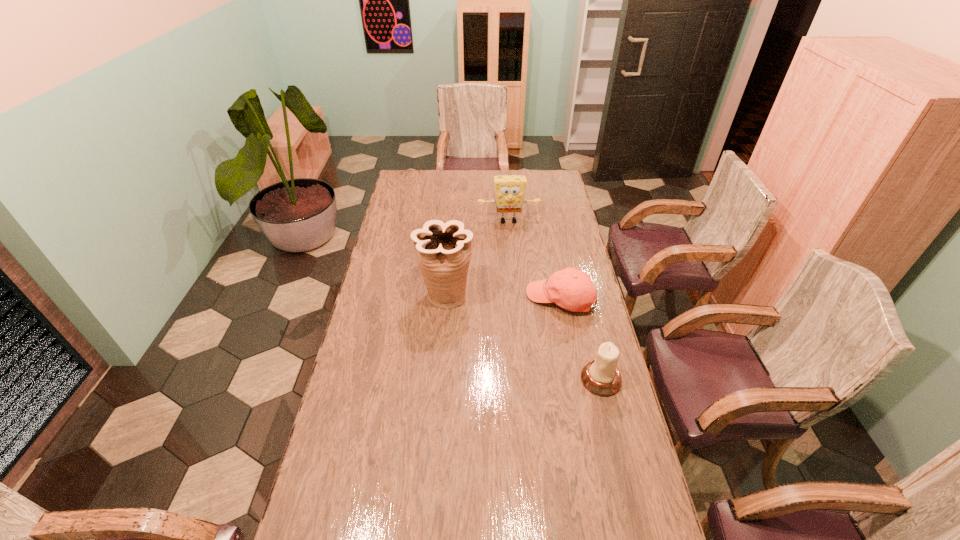
Locate an element on the screen. The height and width of the screenshot is (540, 960). vacant space in between the shortest object and the candle holder is located at coordinates (581, 339).

Image resolution: width=960 pixels, height=540 pixels. In order to click on vacant region between the candle holder and the baseball cap in this screenshot , I will do `click(581, 339)`.

At what (x,y) coordinates should I click in order to perform the action: click on object that can be found as the closest to the candle holder. Please return your answer as a coordinate pair (x, y). The image size is (960, 540). Looking at the image, I should click on (572, 289).

This screenshot has height=540, width=960. What are the coordinates of `object identified as the closest to the shortest object` in the screenshot? It's located at (443, 250).

This screenshot has height=540, width=960. What are the coordinates of `free spot that satisfies the following two spatial constraints: 1. on the front side of the second shortest object; 2. on the left side of the shortest object` in the screenshot? It's located at (575, 380).

Where is `vacant space that satisfies the following two spatial constraints: 1. on the back side of the sponge; 2. on the left side of the urn`? vacant space that satisfies the following two spatial constraints: 1. on the back side of the sponge; 2. on the left side of the urn is located at coordinates (452, 221).

Identify the location of free space that satisfies the following two spatial constraints: 1. on the back side of the farthest object; 2. on the left side of the leftmost object. (452, 221).